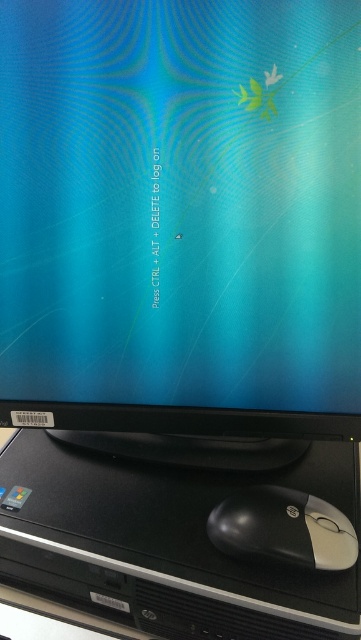
Question: Does black plastic computer at bottom have a greater width compared to black plastic mouse at bottom right?

Choices:
 (A) no
 (B) yes

Answer: (B)

Question: Is the position of black plastic computer at bottom more distant than that of black plastic mouse at bottom right?

Choices:
 (A) no
 (B) yes

Answer: (A)

Question: Can you confirm if black plastic computer at bottom is positioned to the left of black plastic mouse at bottom right?

Choices:
 (A) no
 (B) yes

Answer: (B)

Question: Which object appears closest to the camera in this image?

Choices:
 (A) black plastic mouse at bottom right
 (B) black plastic computer at bottom

Answer: (B)